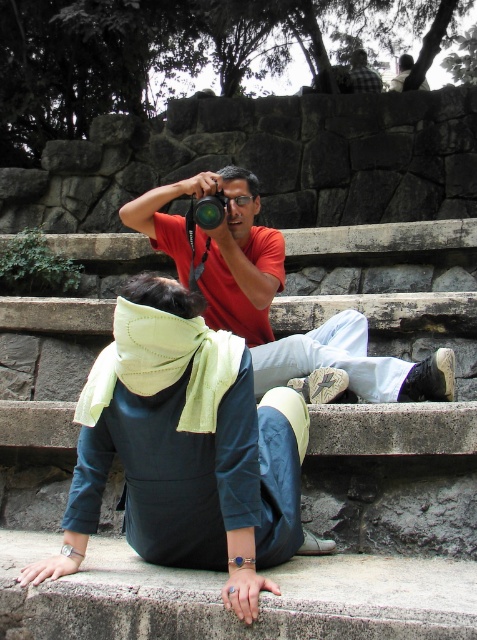
Question: Which object is farther from the camera taking this photo?

Choices:
 (A) matte black camera at center
 (B) matte red shirt at center

Answer: (A)

Question: Is matte red shirt at center thinner than matte black camera at center?

Choices:
 (A) no
 (B) yes

Answer: (A)

Question: Does matte red shirt at center have a smaller size compared to matte black camera at center?

Choices:
 (A) no
 (B) yes

Answer: (A)

Question: Is matte red shirt at center wider than matte black camera at center?

Choices:
 (A) yes
 (B) no

Answer: (A)

Question: Among these objects, which one is farthest from the camera?

Choices:
 (A) matte black camera at center
 (B) matte red shirt at center

Answer: (A)

Question: Which of the following is the farthest from the observer?

Choices:
 (A) (199, 221)
 (B) (154, 237)

Answer: (B)